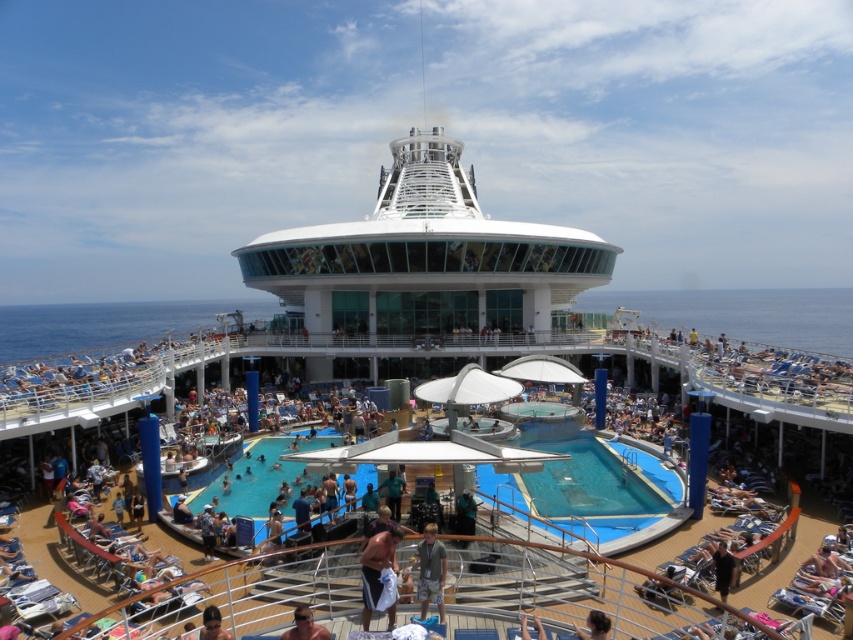
Question: Which point is farther from the camera taking this photo?

Choices:
 (A) [312, 621]
 (B) [444, 579]
 (C) [573, 624]
 (D) [363, 561]

Answer: (C)

Question: Is white towel at center below dark brown hair at lower right?

Choices:
 (A) no
 (B) yes

Answer: (A)

Question: Is blue rubber pool at center to the right of tan skin man at lower center from the viewer's perspective?

Choices:
 (A) no
 (B) yes

Answer: (B)

Question: Among these objects, which one is farthest from the camera?

Choices:
 (A) blue rubber pool at center
 (B) white towel at center
 (C) blue glossy pool at center

Answer: (C)

Question: Which of the following is the farthest from the observer?

Choices:
 (A) (302, 634)
 (B) (581, 518)
 (C) (225, 490)
 (D) (389, 540)

Answer: (C)

Question: Can you confirm if white towel at center is bigger than tan skin man at lower center?

Choices:
 (A) no
 (B) yes

Answer: (B)